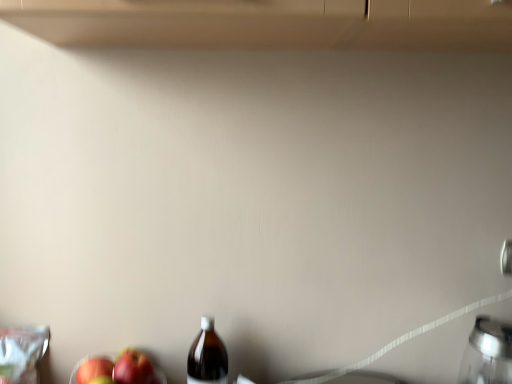
Image resolution: width=512 pixels, height=384 pixels. Describe the element at coordinates (207, 356) in the screenshot. I see `brown glass bottle at center` at that location.

Identify the location of brown glass bottle at center. (207, 356).

Where is `brown glass bottle at center`? The height and width of the screenshot is (384, 512). brown glass bottle at center is located at coordinates (207, 356).